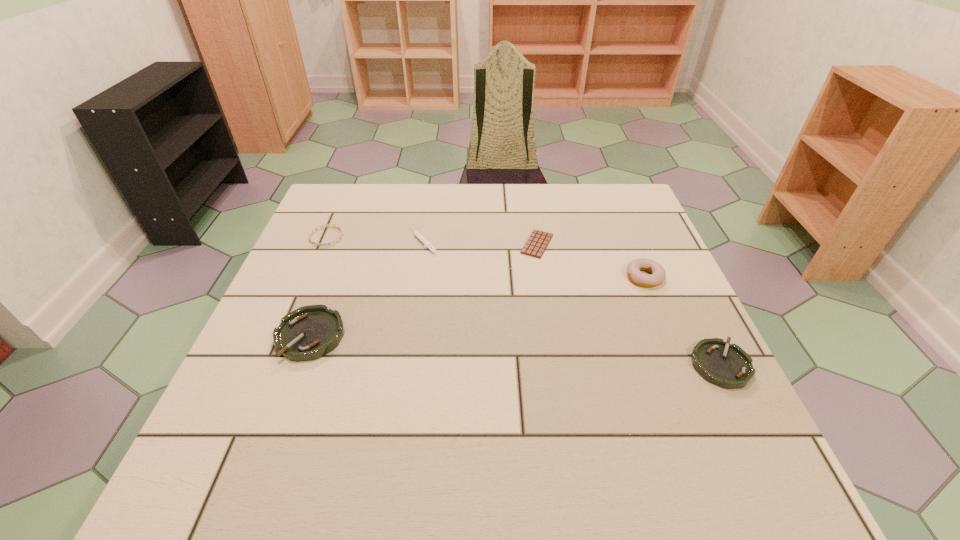
I want to click on the taller ashtray, so click(308, 333).

This screenshot has height=540, width=960. What are the coordinates of `the fourth shortest object` in the screenshot? It's located at (726, 365).

You are a GUI agent. You are given a task and a screenshot of the screen. Output one action in this format:
    pyautogui.click(x=<x>, y=<y>)
    Task: Click on the right ashtray
    Image resolution: width=960 pixels, height=540 pixels.
    Given the screenshot: What is the action you would take?
    pyautogui.click(x=726, y=365)

Locate an element on the screen. bracelet is located at coordinates (335, 225).

At what (x,y) coordinates should I click in order to perform the action: click on the fourth object from right to left. Please return your answer as a coordinate pair (x, y). Image resolution: width=960 pixels, height=540 pixels. Looking at the image, I should click on (427, 244).

I want to click on candy bar, so click(x=538, y=241).

Where is `the shortest object`? This screenshot has height=540, width=960. the shortest object is located at coordinates (538, 241).

This screenshot has width=960, height=540. Find the location of `doughnut`. doughnut is located at coordinates (658, 274).

Locate an element on the screen. free point located 0.330m on the back of the left ashtray is located at coordinates (351, 226).

You are a GUI agent. You are given a task and a screenshot of the screen. Output one action in this format:
    pyautogui.click(x=<x>, y=<y>)
    Task: Click on the vacant space located on the back of the right ashtray
    
    Given the screenshot: What is the action you would take?
    pyautogui.click(x=683, y=287)